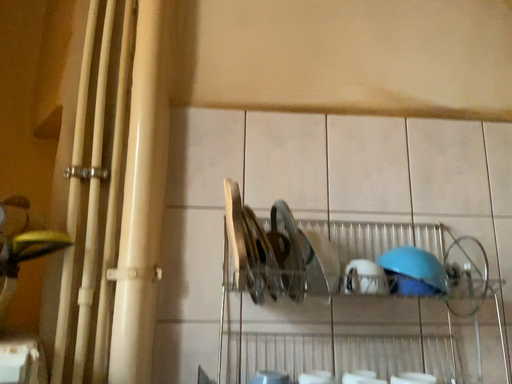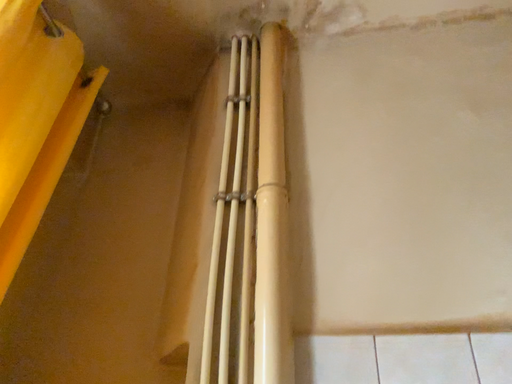
Question: How did the camera likely rotate when shooting the video?

Choices:
 (A) rotated right
 (B) rotated left

Answer: (B)